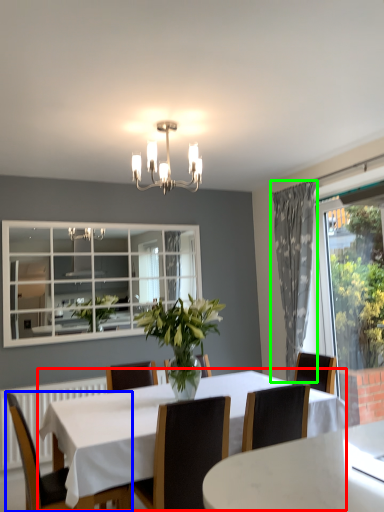
Question: Based on their relative distances, which object is farther from kitchen & dining room table (highlighted by a red box)? Choose from chair (highlighted by a blue box) and curtain (highlighted by a green box).

Choices:
 (A) chair
 (B) curtain

Answer: (B)